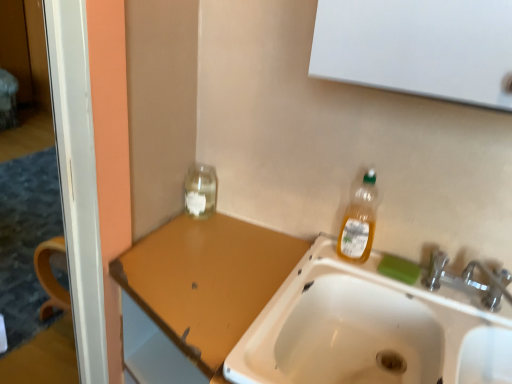
Where is `vacant area on top of brown matte counter top at upper left (from a real-world perspective)`? Image resolution: width=512 pixels, height=384 pixels. vacant area on top of brown matte counter top at upper left (from a real-world perspective) is located at coordinates (201, 270).